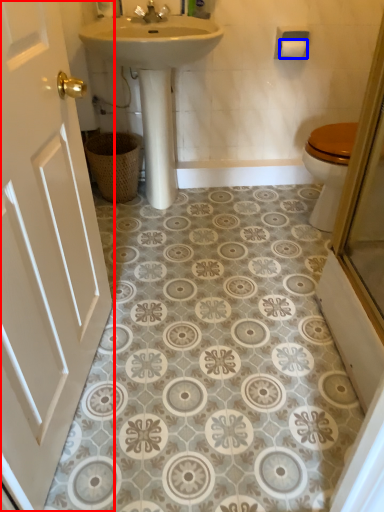
Question: Among these objects, which one is nearest to the camera, door (highlighted by a red box) or toilet paper (highlighted by a blue box)?

Choices:
 (A) door
 (B) toilet paper

Answer: (A)